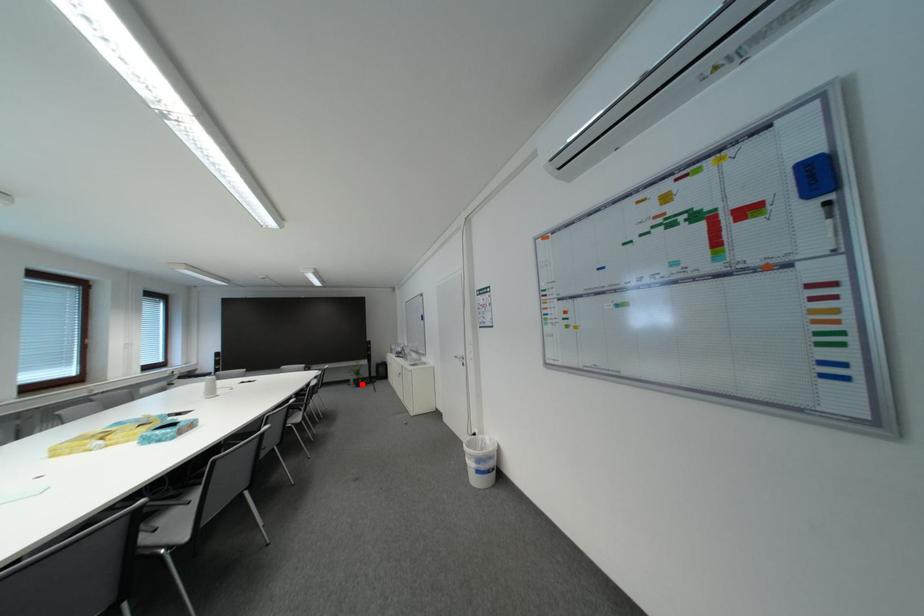
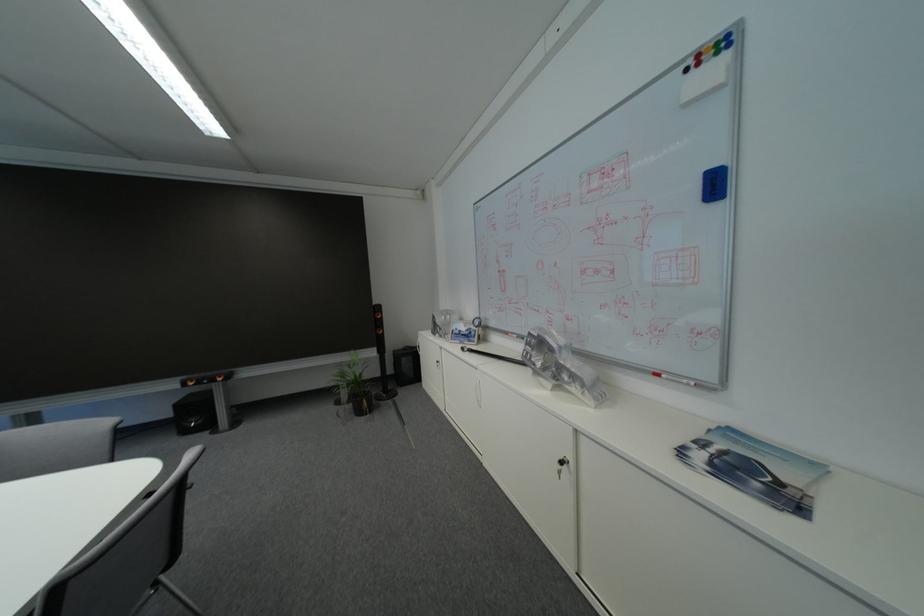
Question: I am providing you with two images of the same scene from different viewpoints. In image1, a red point is highlighted. Considering the same 3D point in image2, which of the following is correct?

Choices:
 (A) It is closer
 (B) It is farther

Answer: (A)